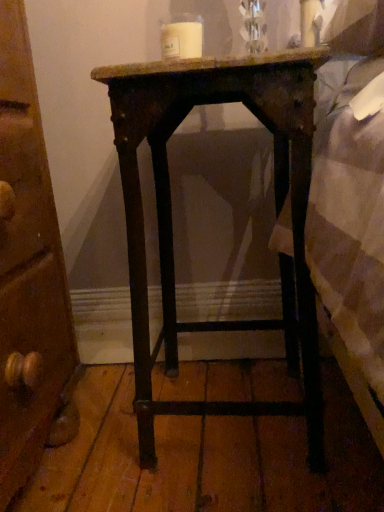
Question: In terms of width, does wooden nightstand at center look wider or thinner when compared to white matte candle at upper center?

Choices:
 (A) wide
 (B) thin

Answer: (A)

Question: Does point (124, 188) appear closer or farther from the camera than point (168, 50)?

Choices:
 (A) farther
 (B) closer

Answer: (B)

Question: From the image's perspective, relative to white matte candle at upper center, is wooden nightstand at center above or below?

Choices:
 (A) below
 (B) above

Answer: (A)

Question: Considering the positions of point (162, 53) and point (248, 56), is point (162, 53) closer or farther from the camera than point (248, 56)?

Choices:
 (A) closer
 (B) farther

Answer: (B)

Question: In the image, is white matte candle at upper center on the left side or the right side of wooden nightstand at center?

Choices:
 (A) right
 (B) left

Answer: (B)

Question: Is white matte candle at upper center wider or thinner than wooden nightstand at center?

Choices:
 (A) wide
 (B) thin

Answer: (B)

Question: From their relative heights in the image, would you say white matte candle at upper center is taller or shorter than wooden nightstand at center?

Choices:
 (A) tall
 (B) short

Answer: (B)